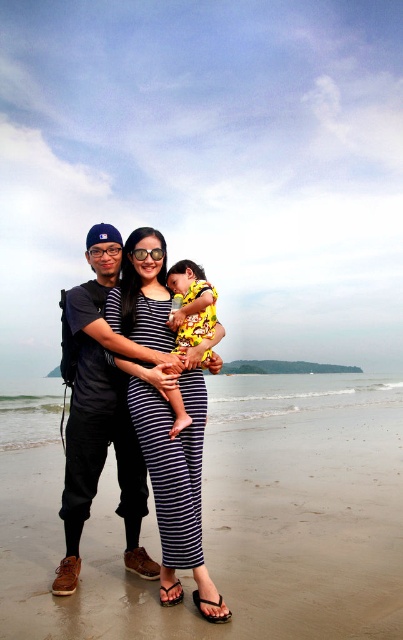
You are planning to build a sandcastle on the beach. You have a bucket that can hold up to 2 liters of sand. Considering the size of the brown sand at lower center and the matte black backpack at left, which object would be more suitable to use as a base for your sandcastle?

The brown sand at lower center is larger in size than the matte black backpack at left, so it would be more suitable to use as a base for the sandcastle because larger sand particles provide better stability and structure.

You are a photographer trying to capture a group photo of the family. You need to ensure that both the striped fabric dress at center and the yellow printed fabric at center are visible in the frame. Given their sizes, which one should you focus on to ensure both are fully visible?

The striped fabric dress at center is wider than the yellow printed fabric at center, so focusing on the striped fabric dress at center would ensure both are fully visible as it requires more space in the frame.